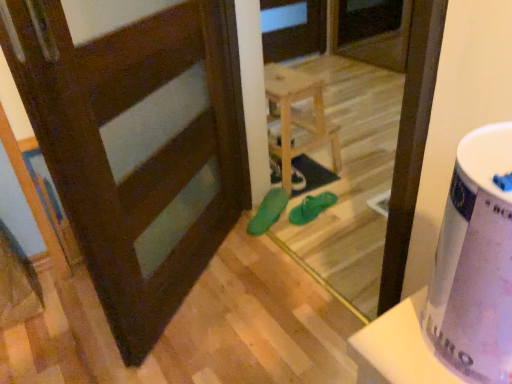
Question: Is green rubber sandals at center, arranged as the 1th footwear when viewed from the left, oriented towards light wood stool at center?

Choices:
 (A) no
 (B) yes

Answer: (B)

Question: From a real-world perspective, is green rubber sandals at center, arranged as the 1th footwear when viewed from the left, on top of light wood stool at center?

Choices:
 (A) yes
 (B) no

Answer: (B)

Question: Could light wood stool at center be considered to be inside green rubber sandals at center, arranged as the 1th footwear when viewed from the left?

Choices:
 (A) no
 (B) yes

Answer: (A)

Question: Considering the relative sizes of green rubber sandals at center, arranged as the 1th footwear when viewed from the left, and light wood stool at center in the image provided, is green rubber sandals at center, arranged as the 1th footwear when viewed from the left, taller than light wood stool at center?

Choices:
 (A) yes
 (B) no

Answer: (B)

Question: Is the position of green rubber sandals at center, arranged as the 1th footwear when viewed from the left, less distant than that of light wood stool at center?

Choices:
 (A) no
 (B) yes

Answer: (B)

Question: Is matte green shoe at center bigger or smaller than green rubber sandals at center, marked as the second footwear in a right-to-left arrangement?

Choices:
 (A) big
 (B) small

Answer: (B)

Question: Is matte green shoe at center taller or shorter than green rubber sandals at center, marked as the second footwear in a right-to-left arrangement?

Choices:
 (A) short
 (B) tall

Answer: (A)

Question: In terms of width, does matte green shoe at center look wider or thinner when compared to green rubber sandals at center, marked as the second footwear in a right-to-left arrangement?

Choices:
 (A) thin
 (B) wide

Answer: (A)

Question: Is matte green shoe at center to the left or to the right of green rubber sandals at center, arranged as the 1th footwear when viewed from the left, in the image?

Choices:
 (A) left
 (B) right

Answer: (B)

Question: From the image's perspective, is green rubber flip-flops at center, which is counted as the 2th footwear, starting from the left, located above or below green rubber sandals at center?

Choices:
 (A) above
 (B) below

Answer: (B)

Question: Considering their positions, is green rubber flip-flops at center, which is the first footwear from right to left, located in front of or behind green rubber sandals at center?

Choices:
 (A) behind
 (B) front

Answer: (A)

Question: From a real-world perspective, is green rubber flip-flops at center, which is counted as the 2th footwear, starting from the left, above or below green rubber sandals at center?

Choices:
 (A) above
 (B) below

Answer: (B)

Question: Is green rubber flip-flops at center, which is counted as the 2th footwear, starting from the left, inside the boundaries of green rubber sandals at center, or outside?

Choices:
 (A) inside
 (B) outside

Answer: (B)

Question: From the image's perspective, is matte green shoe at center above or below white glossy potty at right?

Choices:
 (A) below
 (B) above

Answer: (B)

Question: From a real-world perspective, is matte green shoe at center positioned above or below white glossy potty at right?

Choices:
 (A) below
 (B) above

Answer: (A)